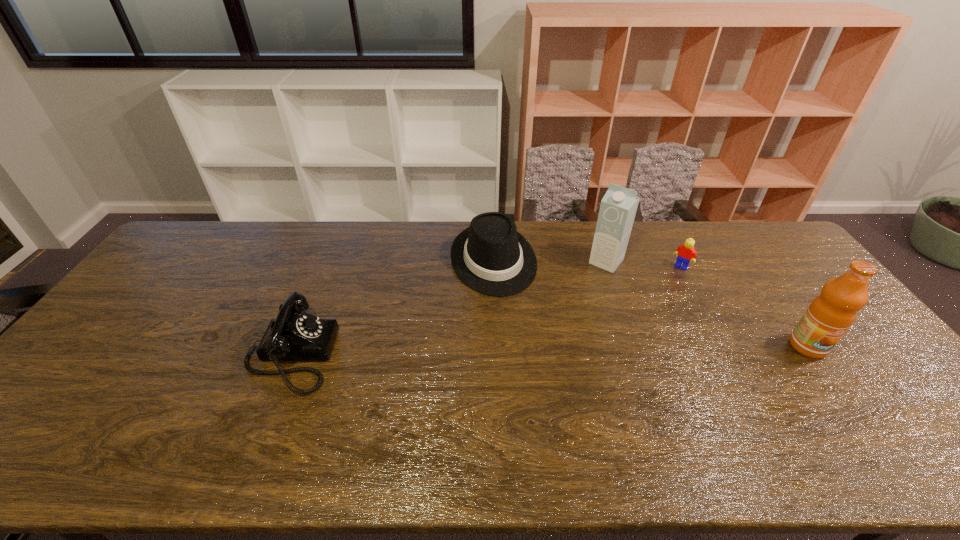
The width and height of the screenshot is (960, 540). Find the location of `free space located 0.060m on the front-facing side of the fourth object from right to left`. free space located 0.060m on the front-facing side of the fourth object from right to left is located at coordinates (509, 310).

Where is `vacant area located on the front-facing side of the Lego`? This screenshot has height=540, width=960. vacant area located on the front-facing side of the Lego is located at coordinates (663, 288).

You are a GUI agent. You are given a task and a screenshot of the screen. Output one action in this format:
    pyautogui.click(x=<x>, y=<y>)
    Task: Click on the free spot located on the front-facing side of the Lego
    
    Given the screenshot: What is the action you would take?
    pos(645,310)

Identify the location of vacant space located on the front-facing side of the Lego. (645, 310).

Find the location of a particular element. Image resolution: width=960 pixels, height=540 pixels. free space located 0.280m on the front label of the third object from right to left is located at coordinates (556, 322).

Where is `vacant space located on the front label of the third object from right to left`? The height and width of the screenshot is (540, 960). vacant space located on the front label of the third object from right to left is located at coordinates (564, 312).

The image size is (960, 540). Identify the location of blank area located 0.120m on the front label of the third object from right to left. (582, 291).

Find the location of a particular element. The height and width of the screenshot is (540, 960). fedora that is at the far edge is located at coordinates (490, 256).

Identify the location of Lego present at the far edge. The height and width of the screenshot is (540, 960). (686, 253).

Identify the location of carton that is at the far edge. The height and width of the screenshot is (540, 960). (618, 207).